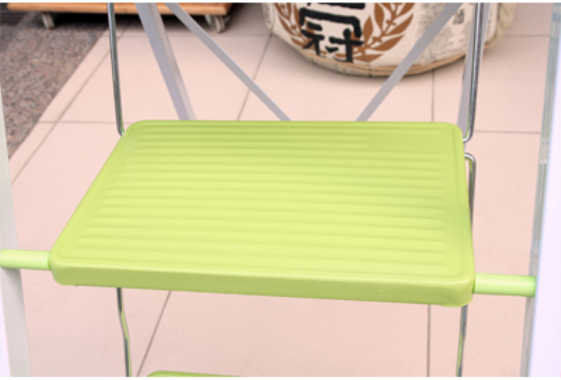
Identify the location of grey grout lines. (56, 121), (491, 129), (254, 68), (163, 313).